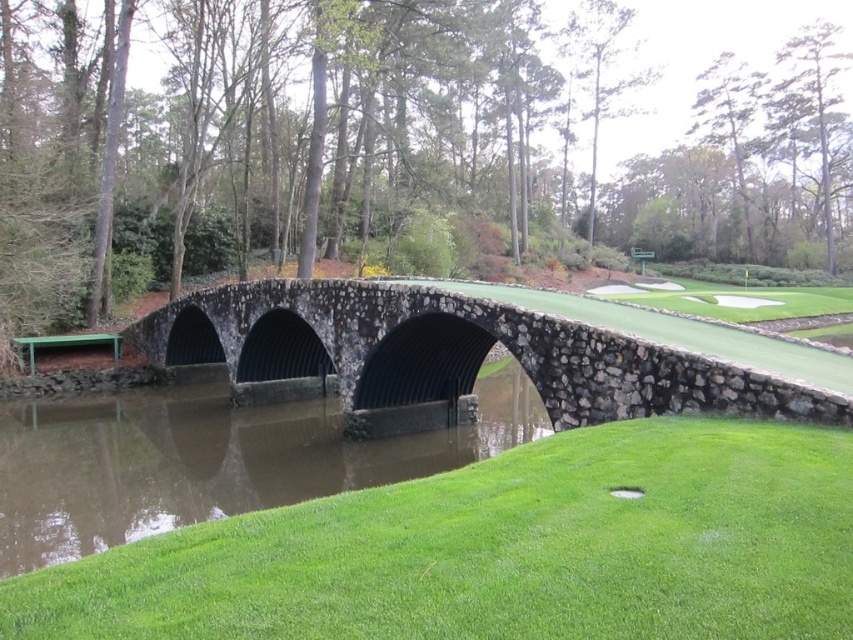
Question: Can you confirm if green grassy hill at lower center is positioned to the right of stone bridge at center?

Choices:
 (A) yes
 (B) no

Answer: (A)

Question: Estimate the real-world distances between objects in this image. Which object is farther from the green grassy hill at lower center?

Choices:
 (A) stone bridge at center
 (B) brown/muddy water at center

Answer: (B)

Question: Does green grassy hill at lower center appear under brown/muddy water at center?

Choices:
 (A) yes
 (B) no

Answer: (B)

Question: Which point appears closest to the camera in this image?

Choices:
 (A) (61, 548)
 (B) (750, 340)

Answer: (A)

Question: Which is farther from the green grassy hill at lower center?

Choices:
 (A) stone bridge at center
 (B) brown/muddy water at center

Answer: (B)

Question: Can you confirm if green grassy hill at lower center is smaller than brown/muddy water at center?

Choices:
 (A) no
 (B) yes

Answer: (B)